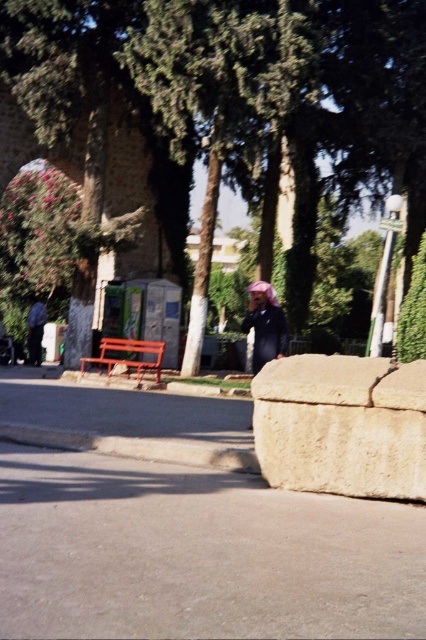
Question: Which point is farther from the camera taking this photo?

Choices:
 (A) (357, 467)
 (B) (307, 84)
 (C) (267, 289)

Answer: (B)

Question: Which point appears closest to the camera in this image?

Choices:
 (A) (279, 552)
 (B) (379, 109)
 (C) (278, 323)

Answer: (A)

Question: Which of the following is the farthest from the observer?

Choices:
 (A) (252, 365)
 (B) (328, 52)
 (C) (420, 429)

Answer: (B)

Question: Is smooth concrete pavement at lower center thinner than beige rough stone at lower right?

Choices:
 (A) yes
 (B) no

Answer: (B)

Question: Does smooth concrete pavement at lower center appear on the left side of green leafy tree at center?

Choices:
 (A) yes
 (B) no

Answer: (A)

Question: Can you confirm if beige rough stone at lower right is wider than dark blue fabric at center?

Choices:
 (A) yes
 (B) no

Answer: (A)